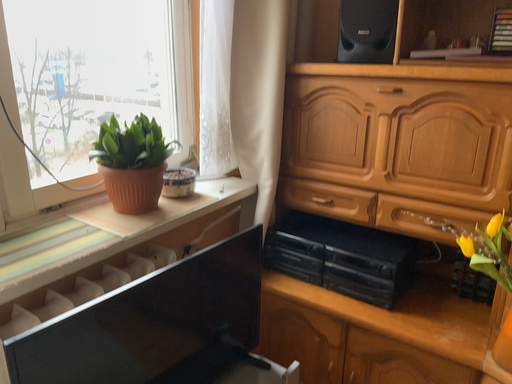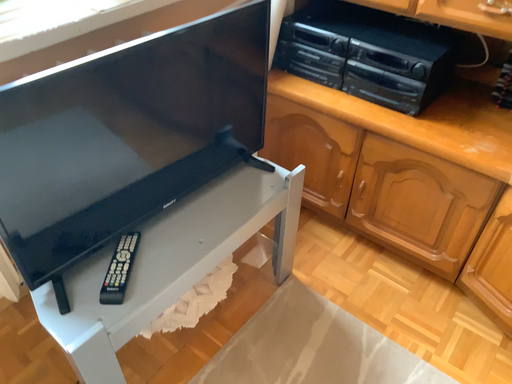
Question: How did the camera likely rotate when shooting the video?

Choices:
 (A) rotated downward
 (B) rotated upward

Answer: (A)